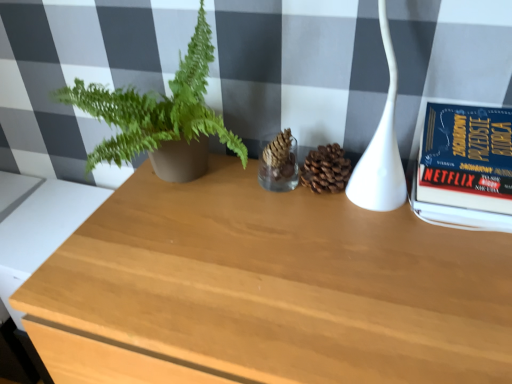
Locate an element on the screen. This screenshot has width=512, height=384. wooden table at center, which appears as the second table when viewed from the left is located at coordinates (267, 290).

Describe the element at coordinates (381, 147) in the screenshot. I see `white glossy lamp at upper right` at that location.

Find the location of a particular element. The height and width of the screenshot is (384, 512). light wood table at lower left, the second table when ordered from right to left is located at coordinates (41, 230).

Considering the relative positions of hardcover book at right and white glossy lamp at upper right in the image provided, is hardcover book at right to the left of white glossy lamp at upper right from the viewer's perspective?

In fact, hardcover book at right is to the right of white glossy lamp at upper right.

Who is shorter, hardcover book at right or white glossy lamp at upper right?

With less height is hardcover book at right.

Is hardcover book at right completely or partially outside of white glossy lamp at upper right?

hardcover book at right is positioned outside white glossy lamp at upper right.

From a real-world perspective, is hardcover book at right beneath white glossy lamp at upper right?

Yes.

Who is smaller, hardcover book at right or green matte plant at left?

hardcover book at right.

Which object is further away from the camera taking this photo, hardcover book at right or green matte plant at left?

hardcover book at right is behind.

How different are the orientations of hardcover book at right and green matte plant at left in degrees?

The angular difference between hardcover book at right and green matte plant at left is 1.77 degrees.

Is point (27, 253) positioned in front of point (385, 5)?

No, (27, 253) is further to viewer.

Does light wood table at lower left, the second table when ordered from right to left, have a greater height compared to white glossy lamp at upper right?

Incorrect, the height of light wood table at lower left, the second table when ordered from right to left, is not larger of that of white glossy lamp at upper right.

Does light wood table at lower left, the second table when ordered from right to left, have a smaller size compared to white glossy lamp at upper right?

No.

Is light wood table at lower left, acting as the 1th table starting from the left, further to the viewer compared to white glossy lamp at upper right?

Yes, light wood table at lower left, acting as the 1th table starting from the left, is further from the camera.

Can we say wooden table at center, which appears as the second table when viewed from the left, lies outside green matte plant at left?

Yes, wooden table at center, which appears as the second table when viewed from the left, is not within green matte plant at left.

Can you tell me how much wooden table at center, arranged as the 1th table when viewed from the right, and green matte plant at left differ in facing direction?

0.0669 degrees separate the facing orientations of wooden table at center, arranged as the 1th table when viewed from the right, and green matte plant at left.

Considering the relative sizes of wooden table at center, arranged as the 1th table when viewed from the right, and green matte plant at left in the image provided, is wooden table at center, arranged as the 1th table when viewed from the right, smaller than green matte plant at left?

Incorrect, wooden table at center, arranged as the 1th table when viewed from the right, is not smaller in size than green matte plant at left.

Measure the distance between white glossy lamp at upper right and wooden table at center, which appears as the second table when viewed from the left.

white glossy lamp at upper right and wooden table at center, which appears as the second table when viewed from the left, are 10.67 inches apart from each other.

From the image's perspective, would you say white glossy lamp at upper right is positioned over wooden table at center, arranged as the 1th table when viewed from the right?

Correct, white glossy lamp at upper right appears higher than wooden table at center, arranged as the 1th table when viewed from the right, in the image.

From a real-world perspective, is white glossy lamp at upper right on wooden table at center, which appears as the second table when viewed from the left?

Indeed, from a real-world perspective, white glossy lamp at upper right stands above wooden table at center, which appears as the second table when viewed from the left.

Is light wood table at lower left, the second table when ordered from right to left, in front of or behind green matte plant at left in the image?

Visually, light wood table at lower left, the second table when ordered from right to left, is located behind green matte plant at left.

Does light wood table at lower left, the second table when ordered from right to left, turn towards green matte plant at left?

No, light wood table at lower left, the second table when ordered from right to left, is not oriented towards green matte plant at left.

Is light wood table at lower left, the second table when ordered from right to left, not near green matte plant at left?

light wood table at lower left, the second table when ordered from right to left, is near green matte plant at left, not far away.

You are a GUI agent. You are given a task and a screenshot of the screen. Output one action in this format:
    pyautogui.click(x=<x>, y=<y>)
    Task: Click on the table located behind the green matte plant at left
    This screenshot has height=384, width=512.
    Given the screenshot: What is the action you would take?
    pyautogui.click(x=41, y=230)

Is light wood table at lower left, the second table when ordered from right to left, bigger than wooden table at center, which appears as the second table when viewed from the left?

No, light wood table at lower left, the second table when ordered from right to left, is not bigger than wooden table at center, which appears as the second table when viewed from the left.

Is light wood table at lower left, acting as the 1th table starting from the left, at the left side of wooden table at center, arranged as the 1th table when viewed from the right?

Correct, you'll find light wood table at lower left, acting as the 1th table starting from the left, to the left of wooden table at center, arranged as the 1th table when viewed from the right.

From a real-world perspective, is light wood table at lower left, the second table when ordered from right to left, under wooden table at center, arranged as the 1th table when viewed from the right?

No, from a real-world perspective, light wood table at lower left, the second table when ordered from right to left, is not below wooden table at center, arranged as the 1th table when viewed from the right.

I want to click on lamp that is above the hardcover book at right (from the image's perspective), so click(381, 147).

At what (x,y) coordinates should I click in order to perform the action: click on houseplant that is on the left side of hardcover book at right. Please return your answer as a coordinate pair (x, y). The image size is (512, 384). Looking at the image, I should click on (160, 117).

Estimate the real-world distances between objects in this image. Which object is further from hardcover book at right, green matte plant at left or wooden table at center, arranged as the 1th table when viewed from the right?

Based on the image, green matte plant at left appears to be further to hardcover book at right.

Which object lies further to the anchor point green matte plant at left, hardcover book at right or light wood table at lower left, the second table when ordered from right to left?

The object further to green matte plant at left is hardcover book at right.

Considering their positions, is light wood table at lower left, acting as the 1th table starting from the left, positioned further to green matte plant at left than hardcover book at right?

The object further to green matte plant at left is hardcover book at right.

Which object lies nearer to the anchor point wooden table at center, arranged as the 1th table when viewed from the right, green matte plant at left or light wood table at lower left, acting as the 1th table starting from the left?

green matte plant at left.

When comparing their distances from hardcover book at right, does light wood table at lower left, the second table when ordered from right to left, or white glossy lamp at upper right seem closer?

white glossy lamp at upper right is positioned closer to the anchor hardcover book at right.

Based on their spatial positions, is light wood table at lower left, acting as the 1th table starting from the left, or wooden table at center, which appears as the second table when viewed from the left, closer to green matte plant at left?

wooden table at center, which appears as the second table when viewed from the left, is positioned closer to the anchor green matte plant at left.

When comparing their distances from white glossy lamp at upper right, does hardcover book at right or light wood table at lower left, acting as the 1th table starting from the left, seem further?

light wood table at lower left, acting as the 1th table starting from the left, is further to white glossy lamp at upper right.

When comparing their distances from green matte plant at left, does hardcover book at right or white glossy lamp at upper right seem further?

The object further to green matte plant at left is hardcover book at right.

Locate an element on the screen. houseplant between light wood table at lower left, acting as the 1th table starting from the left, and wooden table at center, which appears as the second table when viewed from the left, from left to right is located at coordinates (160, 117).

I want to click on paperback book between green matte plant at left and wooden table at center, arranged as the 1th table when viewed from the right, from top to bottom, so click(465, 166).

Locate an element on the screen. houseplant that lies between white glossy lamp at upper right and wooden table at center, which appears as the second table when viewed from the left, from top to bottom is located at coordinates (160, 117).

Find the location of a particular element. Image resolution: width=512 pixels, height=384 pixels. paperback book between white glossy lamp at upper right and wooden table at center, which appears as the second table when viewed from the left, from top to bottom is located at coordinates (465, 166).